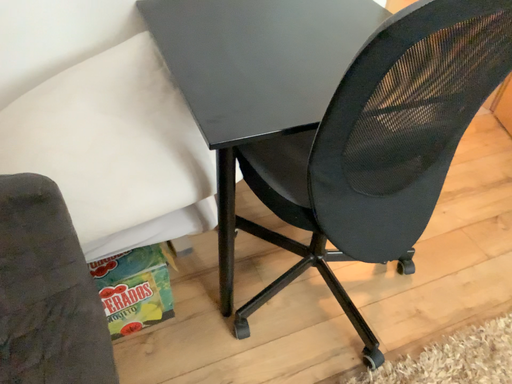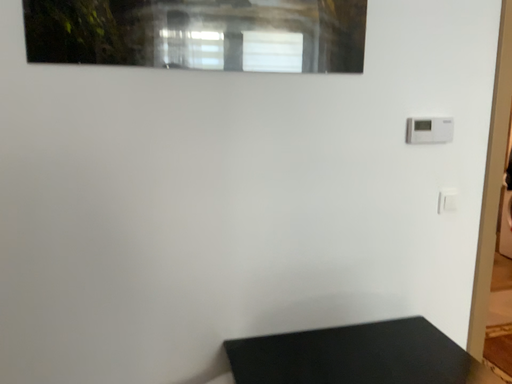
Question: How did the camera likely rotate when shooting the video?

Choices:
 (A) rotated right
 (B) rotated left

Answer: (B)